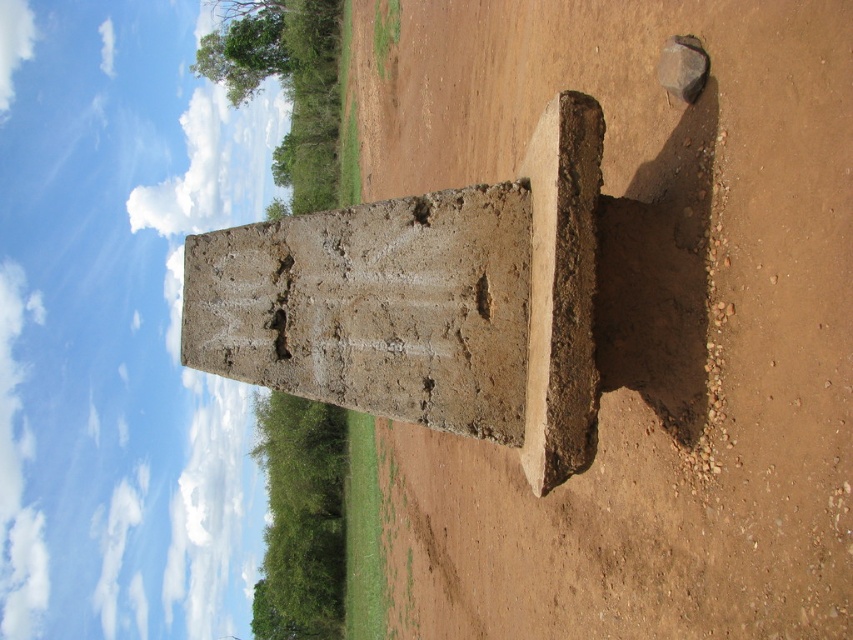
Does brown dirt at center have a greater width compared to gray concrete pillar at center?

Correct, the width of brown dirt at center exceeds that of gray concrete pillar at center.

Between point (619, 168) and point (418, 310), which one is positioned in front?

Point (418, 310) is more forward.

What do you see at coordinates (640, 321) in the screenshot?
I see `brown dirt at center` at bounding box center [640, 321].

This screenshot has width=853, height=640. What are the coordinates of `brown dirt at center` in the screenshot? It's located at (640, 321).